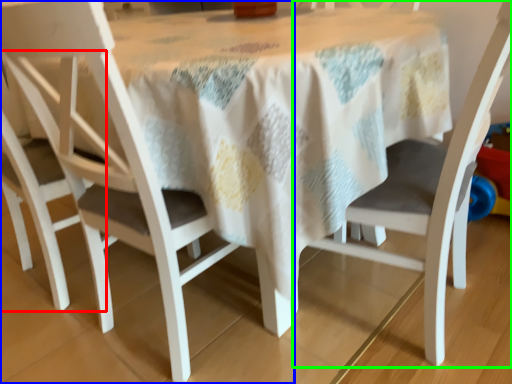
Question: Which is nearer to the chair (highlighted by a red box)? chair (highlighted by a blue box) or chair (highlighted by a green box).

Choices:
 (A) chair
 (B) chair

Answer: (A)